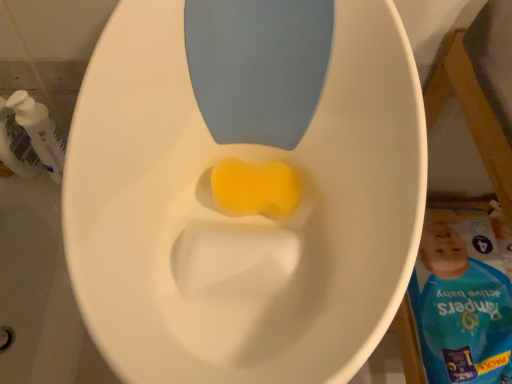
Question: Is yellow sponge at center wider than white plastic pump bottle at left?

Choices:
 (A) no
 (B) yes

Answer: (B)

Question: Considering the relative sizes of yellow sponge at center and white plastic pump bottle at left in the image provided, is yellow sponge at center shorter than white plastic pump bottle at left?

Choices:
 (A) yes
 (B) no

Answer: (A)

Question: Can you confirm if yellow sponge at center is bigger than white plastic pump bottle at left?

Choices:
 (A) no
 (B) yes

Answer: (A)

Question: Is yellow sponge at center oriented away from white plastic pump bottle at left?

Choices:
 (A) no
 (B) yes

Answer: (A)

Question: From the image's perspective, would you say yellow sponge at center is shown under white plastic pump bottle at left?

Choices:
 (A) no
 (B) yes

Answer: (B)

Question: Is yellow sponge at center positioned far away from white plastic pump bottle at left?

Choices:
 (A) no
 (B) yes

Answer: (A)

Question: Does white plastic pump bottle at left have a lesser width compared to yellow sponge at center?

Choices:
 (A) no
 (B) yes

Answer: (B)

Question: Is white plastic pump bottle at left behind yellow sponge at center?

Choices:
 (A) no
 (B) yes

Answer: (B)

Question: Can you confirm if white plastic pump bottle at left is wider than yellow sponge at center?

Choices:
 (A) no
 (B) yes

Answer: (A)

Question: Does white plastic pump bottle at left have a larger size compared to yellow sponge at center?

Choices:
 (A) yes
 (B) no

Answer: (A)

Question: Would you say yellow sponge at center is part of white plastic pump bottle at left's contents?

Choices:
 (A) no
 (B) yes

Answer: (A)

Question: From the image's perspective, would you say white plastic pump bottle at left is shown under yellow sponge at center?

Choices:
 (A) yes
 (B) no

Answer: (B)

Question: In terms of width, does white plastic pump bottle at left look wider or thinner when compared to yellow sponge at center?

Choices:
 (A) thin
 (B) wide

Answer: (A)